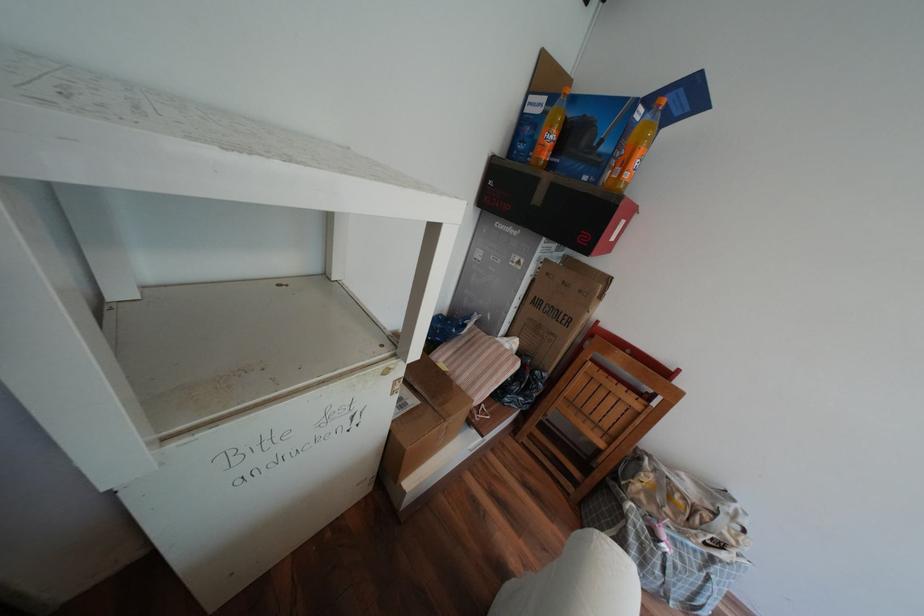
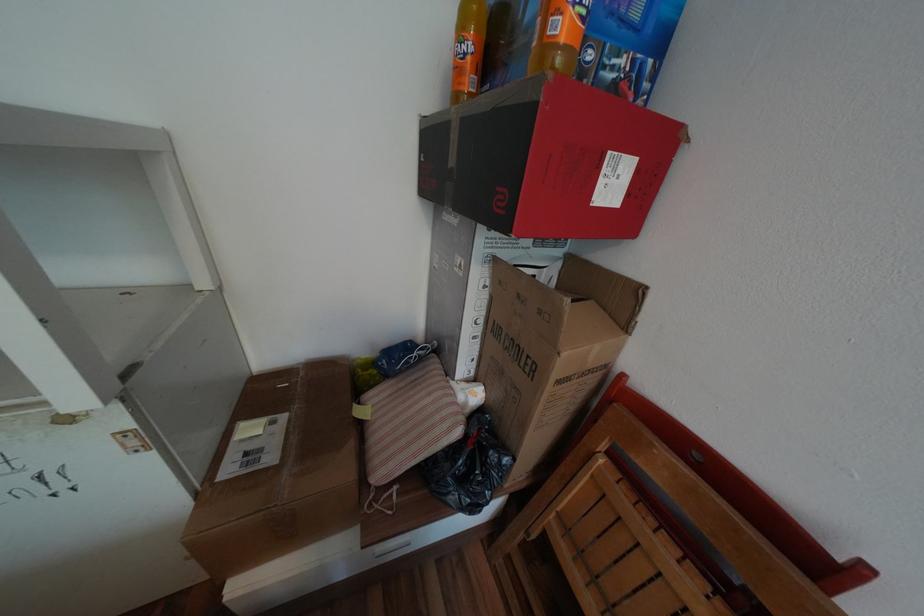
Where in the second image is the point corresponding to (x=545, y=371) from the first image?

(500, 453)